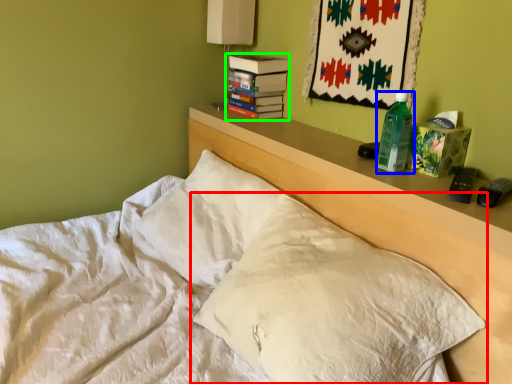
Question: Which object is positioned closest to pillow (highlighted by a red box)? Select from bottle (highlighted by a blue box) and paperback book (highlighted by a green box).

Choices:
 (A) bottle
 (B) paperback book

Answer: (A)